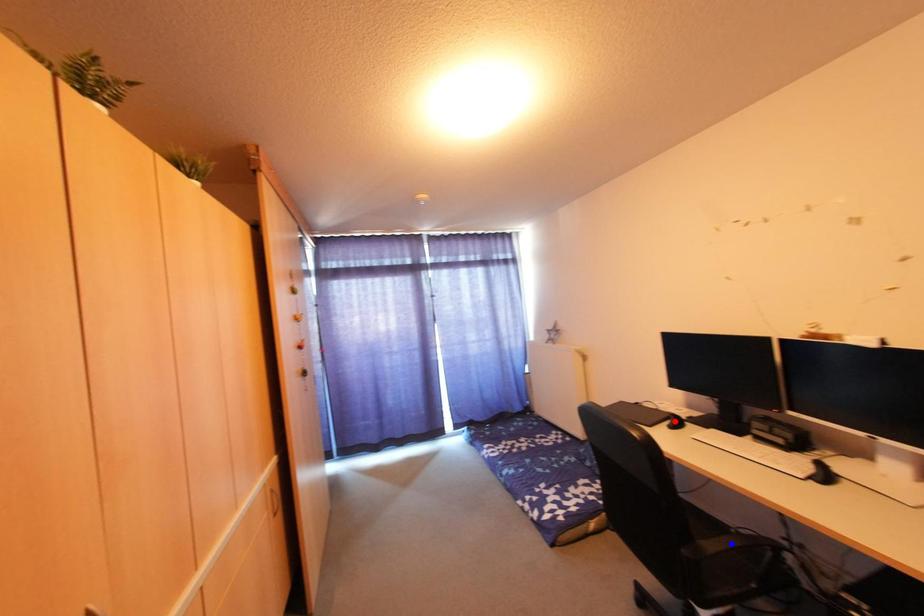
Question: In the image, two points are highlighted. Which point is nearer to the camera? Reply with the corresponding letter.

Choices:
 (A) blue point
 (B) red point

Answer: (A)